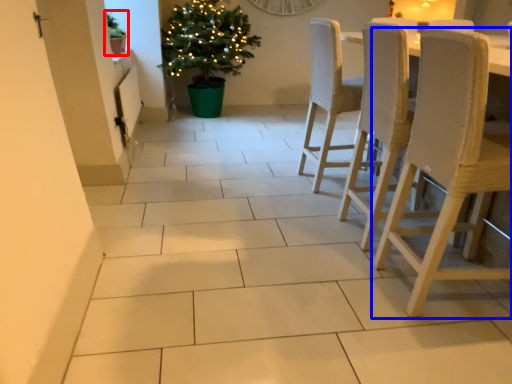
Question: Among these objects, which one is nearest to the camera, houseplant (highlighted by a red box) or chair (highlighted by a blue box)?

Choices:
 (A) houseplant
 (B) chair

Answer: (B)